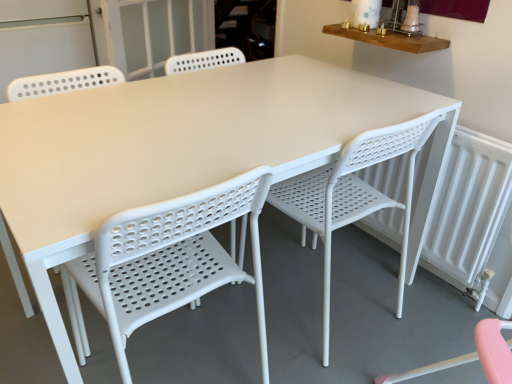
Question: Is white plastic chair at center, placed as the 1th chair when sorted from right to left, taller or shorter than white perforated plastic chair at center, arranged as the 2th chair when viewed from the right?

Choices:
 (A) tall
 (B) short

Answer: (A)

Question: In terms of width, does white plastic chair at center, placed as the 1th chair when sorted from right to left, look wider or thinner when compared to white perforated plastic chair at center, arranged as the 2th chair when viewed from the right?

Choices:
 (A) wide
 (B) thin

Answer: (A)

Question: Considering the real-world distances, which object is farthest from the transparent glass screen door at upper center, the first screen door from the right?

Choices:
 (A) white plastic chair at center, placed as the 1th chair when sorted from right to left
 (B) white plastic radiator at right
 (C) white perforated plastic chair at center, arranged as the 2th chair when viewed from the right
 (D) white perforated screen door at upper left, the second screen door in the right-to-left sequence

Answer: (B)

Question: Which of these objects is positioned closest to the transparent glass screen door at upper center, the first screen door from the right?

Choices:
 (A) white plastic radiator at right
 (B) white perforated screen door at upper left, placed as the first screen door when sorted from left to right
 (C) white perforated plastic chair at center, arranged as the 2th chair when viewed from the right
 (D) white plastic chair at center, placed as the second chair when sorted from left to right

Answer: (B)